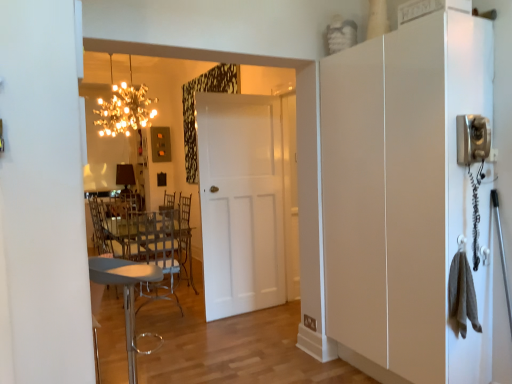
Question: Is the position of clear plastic chair at center, which is the 1th chair in back-to-front order, less distant than that of sparkling crystal chandelier at upper center?

Choices:
 (A) yes
 (B) no

Answer: (A)

Question: Is clear plastic chair at center, which is the 1th chair in back-to-front order, taller than sparkling crystal chandelier at upper center?

Choices:
 (A) yes
 (B) no

Answer: (A)

Question: Does clear plastic chair at center, which is the 1th chair in back-to-front order, have a lesser width compared to sparkling crystal chandelier at upper center?

Choices:
 (A) no
 (B) yes

Answer: (B)

Question: Does clear plastic chair at center, which is the 2th chair from front to back, appear on the left side of sparkling crystal chandelier at upper center?

Choices:
 (A) no
 (B) yes

Answer: (A)

Question: Is clear plastic chair at center, which is the 1th chair in back-to-front order, shorter than sparkling crystal chandelier at upper center?

Choices:
 (A) yes
 (B) no

Answer: (B)

Question: In terms of width, does white matte cabinet at right look wider or thinner when compared to clear plastic chair at center, which is the 1th chair in back-to-front order?

Choices:
 (A) thin
 (B) wide

Answer: (A)

Question: Considering their positions, is white matte cabinet at right located in front of or behind clear plastic chair at center, which is the 1th chair in back-to-front order?

Choices:
 (A) front
 (B) behind

Answer: (A)

Question: Is point (467, 49) closer or farther from the camera than point (172, 231)?

Choices:
 (A) farther
 (B) closer

Answer: (B)

Question: From the image's perspective, relative to clear plastic chair at center, which is the 1th chair in back-to-front order, is white matte cabinet at right above or below?

Choices:
 (A) above
 (B) below

Answer: (A)

Question: From their relative heights in the image, would you say white matte cabinet at right is taller or shorter than metallic gray stool at lower left, which ranks as the 1th chair in front-to-back order?

Choices:
 (A) short
 (B) tall

Answer: (B)

Question: In terms of width, does white matte cabinet at right look wider or thinner when compared to metallic gray stool at lower left, the 2th chair from the back?

Choices:
 (A) wide
 (B) thin

Answer: (B)

Question: Considering the positions of point coord(463,375) and point coord(131,266), is point coord(463,375) closer or farther from the camera than point coord(131,266)?

Choices:
 (A) closer
 (B) farther

Answer: (A)

Question: From a real-world perspective, is white matte cabinet at right physically located above or below metallic gray stool at lower left, the 2th chair from the back?

Choices:
 (A) above
 (B) below

Answer: (A)

Question: Based on their sizes in the image, would you say clear plastic chair at center, which is the 1th chair in back-to-front order, is bigger or smaller than sparkling crystal chandelier at upper center?

Choices:
 (A) small
 (B) big

Answer: (B)

Question: In terms of width, does clear plastic chair at center, which is the 2th chair from front to back, look wider or thinner when compared to sparkling crystal chandelier at upper center?

Choices:
 (A) wide
 (B) thin

Answer: (B)